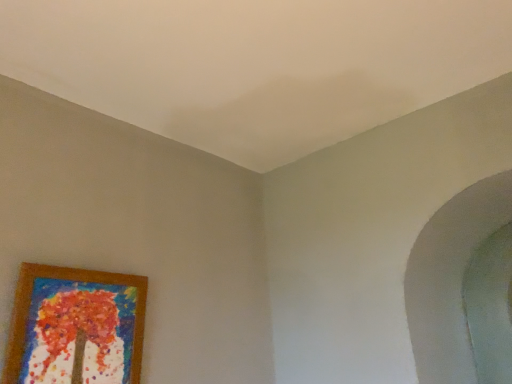
In order to face wooden framed artwork at lower left, should I rotate leftwards or rightwards?

You should rotate left by 22.060 degrees.

This screenshot has width=512, height=384. Identify the location of wooden framed artwork at lower left. (75, 326).

This screenshot has height=384, width=512. What do you see at coordinates (75, 326) in the screenshot?
I see `wooden framed artwork at lower left` at bounding box center [75, 326].

Measure the distance between point (114, 353) and camera.

Point (114, 353) and camera are 4.22 feet apart.

Image resolution: width=512 pixels, height=384 pixels. I want to click on wooden framed artwork at lower left, so click(x=75, y=326).